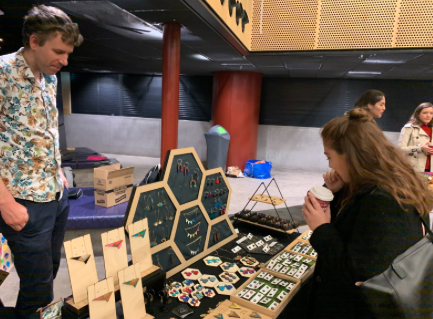
You are a GUI agent. You are given a task and a screenshot of the screen. Output one action in this format:
    pyautogui.click(x=<x>, y=<y>)
    Task: Click on the thick red building support column
    This screenshot has width=433, height=319.
    Given the screenshot: What is the action you would take?
    (x=239, y=94)